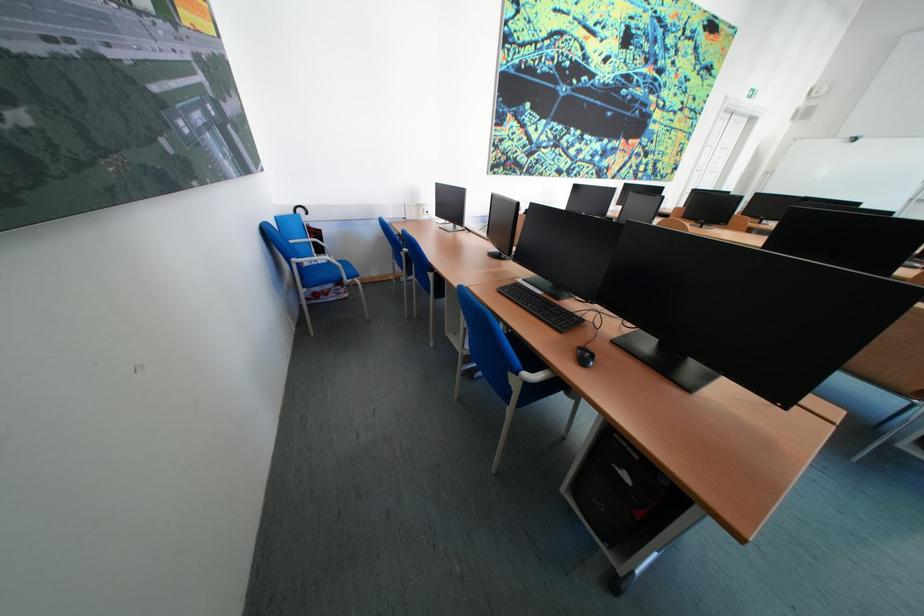
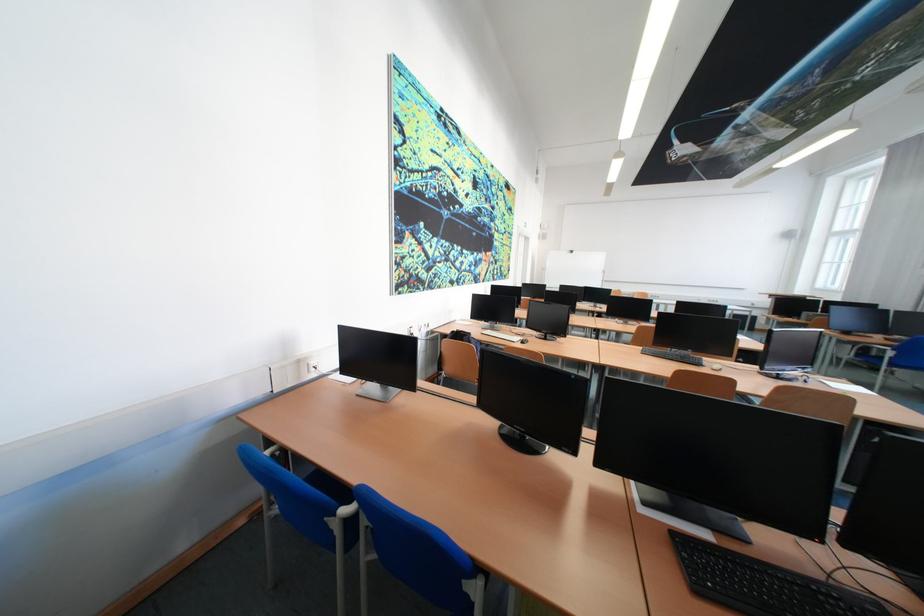
Where in the second image is the point corresponding to pixel 432 207 from the first image?

(311, 363)